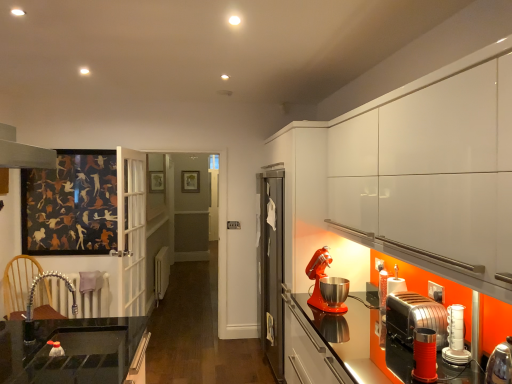
Describe the element at coordinates (190, 182) in the screenshot. I see `wooden picture frame at center` at that location.

What do you see at coordinates (411, 329) in the screenshot? Image resolution: width=512 pixels, height=384 pixels. I see `polished chrome toaster at lower right, the second kitchen appliance from the back` at bounding box center [411, 329].

The width and height of the screenshot is (512, 384). Describe the element at coordinates (320, 278) in the screenshot. I see `metallic red stand mixer at right, placed as the first kitchen appliance when sorted from back to front` at that location.

At what (x,y) coordinates should I click in order to perform the action: click on metallic red stand mixer at right, the fourth kitchen appliance from the front. Please return your answer as a coordinate pair (x, y). This screenshot has width=512, height=384. Looking at the image, I should click on (320, 278).

The image size is (512, 384). What are the coordinates of `white glossy toaster at lower right, the second kitchen appliance when ordered from front to back` in the screenshot? It's located at click(x=456, y=337).

Could you tell me if polished chrome toaster at lower right, which is the third kitchen appliance in front-to-back order, is facing metallic red stand mixer at right, placed as the first kitchen appliance when sorted from back to front?

No, polished chrome toaster at lower right, which is the third kitchen appliance in front-to-back order, is not aimed at metallic red stand mixer at right, placed as the first kitchen appliance when sorted from back to front.

From a real-world perspective, count 2nd kitchen appliances downward from the metallic red stand mixer at right, the fourth kitchen appliance from the front, and point to it. Please provide its 2D coordinates.

[(411, 329)]

Considering the positions of point (387, 356) and point (337, 312), is point (387, 356) closer or farther from the camera than point (337, 312)?

Point (387, 356) is closer to the camera than point (337, 312).

Which object is thinner, polished chrome toaster at lower right, the second kitchen appliance from the back, or metallic red stand mixer at right, placed as the first kitchen appliance when sorted from back to front?

metallic red stand mixer at right, placed as the first kitchen appliance when sorted from back to front, is thinner.

From a real-world perspective, is wooden picture frame at center positioned above or below metallic red toaster at lower right, which appears as the 4th kitchen appliance when viewed from the back?

In terms of real-world spatial position, wooden picture frame at center is above metallic red toaster at lower right, which appears as the 4th kitchen appliance when viewed from the back.

From the image's perspective, is wooden picture frame at center over metallic red toaster at lower right, positioned as the 1th kitchen appliance in front-to-back order?

Yes, from the image's perspective, wooden picture frame at center is over metallic red toaster at lower right, positioned as the 1th kitchen appliance in front-to-back order.

Based on the photo, can you confirm if wooden picture frame at center is positioned to the left of metallic red toaster at lower right, positioned as the 1th kitchen appliance in front-to-back order?

Indeed, wooden picture frame at center is positioned on the left side of metallic red toaster at lower right, positioned as the 1th kitchen appliance in front-to-back order.

Which object is thinner, wooden picture frame at center or metallic red toaster at lower right, which appears as the 4th kitchen appliance when viewed from the back?

With smaller width is wooden picture frame at center.

From the image's perspective, which one is positioned higher, white glossy toaster at lower right, the second kitchen appliance when ordered from front to back, or metallic red stand mixer at right, placed as the first kitchen appliance when sorted from back to front?

metallic red stand mixer at right, placed as the first kitchen appliance when sorted from back to front, appears higher in the image.

Which is correct: white glossy toaster at lower right, the 3th kitchen appliance when ordered from back to front, is inside metallic red stand mixer at right, the fourth kitchen appliance from the front, or outside of it?

white glossy toaster at lower right, the 3th kitchen appliance when ordered from back to front, is not enclosed by metallic red stand mixer at right, the fourth kitchen appliance from the front.

Is point (463, 358) closer or farther from the camera than point (325, 268)?

Point (463, 358) is positioned closer to the camera compared to point (325, 268).

Find the location of a particular element. This screenshot has width=512, height=384. the 3rd kitchen appliance to the right when counting from the metallic red stand mixer at right, the fourth kitchen appliance from the front is located at coordinates (456, 337).

From the picture: Is the position of wooden picture frame at center less distant than that of white glossy toaster at lower right, the 3th kitchen appliance when ordered from back to front?

No, it is not.

Based on the photo, from the image's perspective, who appears lower, wooden picture frame at center or white glossy toaster at lower right, the 3th kitchen appliance when ordered from back to front?

white glossy toaster at lower right, the 3th kitchen appliance when ordered from back to front, is shown below in the image.

Is wooden picture frame at center in contact with white glossy toaster at lower right, the second kitchen appliance when ordered from front to back?

No, wooden picture frame at center is not touching white glossy toaster at lower right, the second kitchen appliance when ordered from front to back.

Is wooden picture frame at center taller or shorter than white glossy toaster at lower right, the second kitchen appliance when ordered from front to back?

wooden picture frame at center is taller than white glossy toaster at lower right, the second kitchen appliance when ordered from front to back.

Considering the sizes of metallic red stand mixer at right, placed as the first kitchen appliance when sorted from back to front, and polished chrome toaster at lower right, which is the third kitchen appliance in front-to-back order, in the image, is metallic red stand mixer at right, placed as the first kitchen appliance when sorted from back to front, bigger or smaller than polished chrome toaster at lower right, which is the third kitchen appliance in front-to-back order,?

In the image, metallic red stand mixer at right, placed as the first kitchen appliance when sorted from back to front, appears to be larger than polished chrome toaster at lower right, which is the third kitchen appliance in front-to-back order.

Is metallic red stand mixer at right, placed as the first kitchen appliance when sorted from back to front, facing towards polished chrome toaster at lower right, the second kitchen appliance from the back?

No, metallic red stand mixer at right, placed as the first kitchen appliance when sorted from back to front, is not aimed at polished chrome toaster at lower right, the second kitchen appliance from the back.

This screenshot has height=384, width=512. In order to click on kitchen appliance that is the 1st object located in front of the metallic red stand mixer at right, the fourth kitchen appliance from the front in this screenshot , I will do `click(411, 329)`.

Is metallic red stand mixer at right, the fourth kitchen appliance from the front, in front of polished chrome toaster at lower right, which is the third kitchen appliance in front-to-back order?

No, the depth of metallic red stand mixer at right, the fourth kitchen appliance from the front, is greater than that of polished chrome toaster at lower right, which is the third kitchen appliance in front-to-back order.

Is metallic red stand mixer at right, the fourth kitchen appliance from the front, facing away from wooden picture frame at center?

No, metallic red stand mixer at right, the fourth kitchen appliance from the front, is not facing away from wooden picture frame at center.

From the image's perspective, does metallic red stand mixer at right, placed as the first kitchen appliance when sorted from back to front, appear lower than wooden picture frame at center?

Yes.

Can we say metallic red stand mixer at right, the fourth kitchen appliance from the front, lies outside wooden picture frame at center?

metallic red stand mixer at right, the fourth kitchen appliance from the front, is positioned outside wooden picture frame at center.

Which object is closer to the camera, metallic red stand mixer at right, placed as the first kitchen appliance when sorted from back to front, or wooden picture frame at center?

metallic red stand mixer at right, placed as the first kitchen appliance when sorted from back to front, is closer to the camera.

In the scene shown: Measure the distance between wooden picture frame at center and metallic red stand mixer at right, placed as the first kitchen appliance when sorted from back to front.

wooden picture frame at center and metallic red stand mixer at right, placed as the first kitchen appliance when sorted from back to front, are 6.90 meters apart.

Between wooden picture frame at center and metallic red stand mixer at right, the fourth kitchen appliance from the front, which one appears on the right side from the viewer's perspective?

From the viewer's perspective, metallic red stand mixer at right, the fourth kitchen appliance from the front, appears more on the right side.

Consider the image. Which object is closer to the camera, wooden picture frame at center or metallic red stand mixer at right, the fourth kitchen appliance from the front?

Positioned in front is metallic red stand mixer at right, the fourth kitchen appliance from the front.

Is wooden picture frame at center wider or thinner than metallic red stand mixer at right, placed as the first kitchen appliance when sorted from back to front?

Considering their sizes, wooden picture frame at center looks slimmer than metallic red stand mixer at right, placed as the first kitchen appliance when sorted from back to front.

The height and width of the screenshot is (384, 512). I want to click on kitchen appliance behind the polished chrome toaster at lower right, which is the third kitchen appliance in front-to-back order, so click(x=320, y=278).

Which kitchen appliance is the 2nd one when counting from the right side of the wooden picture frame at center? Please provide its 2D coordinates.

[(424, 355)]

Based on their spatial positions, is metallic red stand mixer at right, the fourth kitchen appliance from the front, or white glossy toaster at lower right, the 3th kitchen appliance when ordered from back to front, closer to polished chrome toaster at lower right, which is the third kitchen appliance in front-to-back order?

Among the two, white glossy toaster at lower right, the 3th kitchen appliance when ordered from back to front, is located nearer to polished chrome toaster at lower right, which is the third kitchen appliance in front-to-back order.

Consider the image. Based on their spatial positions, is metallic red stand mixer at right, placed as the first kitchen appliance when sorted from back to front, or polished chrome toaster at lower right, which is the third kitchen appliance in front-to-back order, closer to white glossy toaster at lower right, the 3th kitchen appliance when ordered from back to front?

Based on the image, polished chrome toaster at lower right, which is the third kitchen appliance in front-to-back order, appears to be nearer to white glossy toaster at lower right, the 3th kitchen appliance when ordered from back to front.

From the image, which object appears to be nearer to polished chrome toaster at lower right, which is the third kitchen appliance in front-to-back order, white glossy toaster at lower right, the 3th kitchen appliance when ordered from back to front, or wooden picture frame at center?

white glossy toaster at lower right, the 3th kitchen appliance when ordered from back to front, is closer to polished chrome toaster at lower right, which is the third kitchen appliance in front-to-back order.

When comparing their distances from white glossy toaster at lower right, the 3th kitchen appliance when ordered from back to front, does metallic red stand mixer at right, the fourth kitchen appliance from the front, or wooden picture frame at center seem closer?

Among the two, metallic red stand mixer at right, the fourth kitchen appliance from the front, is located nearer to white glossy toaster at lower right, the 3th kitchen appliance when ordered from back to front.

From the image, which object appears to be farther from metallic red toaster at lower right, which appears as the 4th kitchen appliance when viewed from the back, metallic red stand mixer at right, placed as the first kitchen appliance when sorted from back to front, or polished chrome toaster at lower right, the second kitchen appliance from the back?

The object further to metallic red toaster at lower right, which appears as the 4th kitchen appliance when viewed from the back, is metallic red stand mixer at right, placed as the first kitchen appliance when sorted from back to front.

Looking at the image, which one is located closer to polished chrome toaster at lower right, which is the third kitchen appliance in front-to-back order, metallic red toaster at lower right, positioned as the 1th kitchen appliance in front-to-back order, or white glossy toaster at lower right, the 3th kitchen appliance when ordered from back to front?

metallic red toaster at lower right, positioned as the 1th kitchen appliance in front-to-back order, is closer to polished chrome toaster at lower right, which is the third kitchen appliance in front-to-back order.

Based on their spatial positions, is metallic red toaster at lower right, which appears as the 4th kitchen appliance when viewed from the back, or white glossy toaster at lower right, the 3th kitchen appliance when ordered from back to front, closer to wooden picture frame at center?

Among the two, white glossy toaster at lower right, the 3th kitchen appliance when ordered from back to front, is located nearer to wooden picture frame at center.

Considering their positions, is white glossy toaster at lower right, the 3th kitchen appliance when ordered from back to front, positioned further to metallic red toaster at lower right, positioned as the 1th kitchen appliance in front-to-back order, than metallic red stand mixer at right, placed as the first kitchen appliance when sorted from back to front?

metallic red stand mixer at right, placed as the first kitchen appliance when sorted from back to front, lies further to metallic red toaster at lower right, positioned as the 1th kitchen appliance in front-to-back order, than the other object.

Identify the location of kitchen appliance between white glossy toaster at lower right, the 3th kitchen appliance when ordered from back to front, and metallic red stand mixer at right, the fourth kitchen appliance from the front, in the front-back direction. (411, 329).

At what (x,y) coordinates should I click in order to perform the action: click on kitchen appliance between metallic red toaster at lower right, positioned as the 1th kitchen appliance in front-to-back order, and polished chrome toaster at lower right, the second kitchen appliance from the back, from front to back. Please return your answer as a coordinate pair (x, y). Looking at the image, I should click on (456, 337).

Locate an element on the screen. This screenshot has height=384, width=512. kitchen appliance between polished chrome toaster at lower right, the second kitchen appliance from the back, and wooden picture frame at center, along the z-axis is located at coordinates (x=320, y=278).